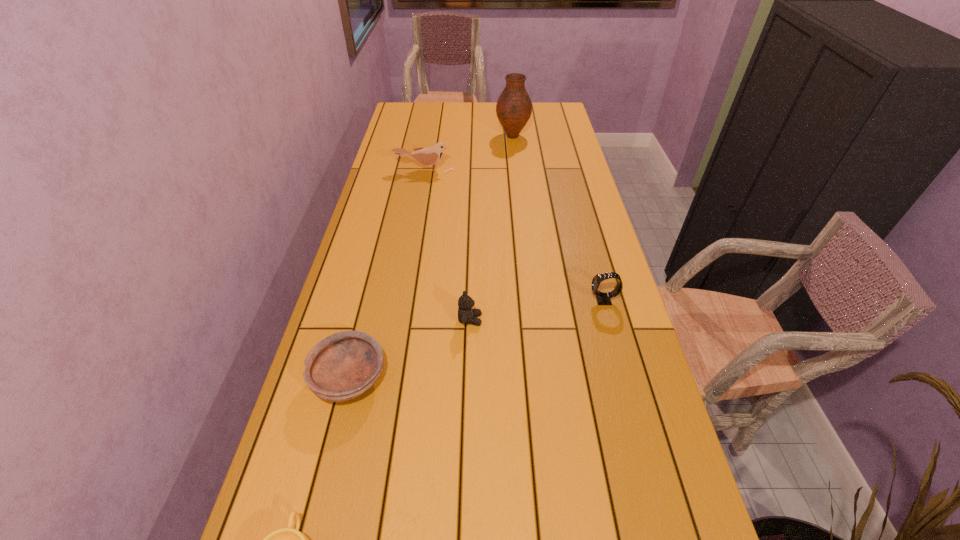
Locate an element on the screen. The width and height of the screenshot is (960, 540). the tallest object is located at coordinates (514, 107).

You are a GUI agent. You are given a task and a screenshot of the screen. Output one action in this format:
    pyautogui.click(x=<x>, y=<y>)
    Task: Click on the farthest object
    
    Given the screenshot: What is the action you would take?
    pyautogui.click(x=514, y=107)

Image resolution: width=960 pixels, height=540 pixels. Find the location of `the fifth shortest object`. the fifth shortest object is located at coordinates (429, 156).

Image resolution: width=960 pixels, height=540 pixels. Find the location of `bird`. bird is located at coordinates (429, 156).

Locate an element on the screen. This screenshot has width=960, height=540. watch is located at coordinates (602, 298).

Where is `the third farthest object`? This screenshot has width=960, height=540. the third farthest object is located at coordinates (602, 298).

Where is `teddy bear`? teddy bear is located at coordinates (467, 315).

You are a GUI agent. You are given a task and a screenshot of the screen. Output one action in this format:
    pyautogui.click(x=<x>, y=<y>)
    Task: Click on the fourth object from left to right
    This screenshot has height=540, width=960.
    Given the screenshot: What is the action you would take?
    pyautogui.click(x=467, y=315)

Find the location of a particular element. This screenshot has width=960, height=540. the second nearest object is located at coordinates coord(344,365).

I want to click on bowl, so click(x=344, y=365).